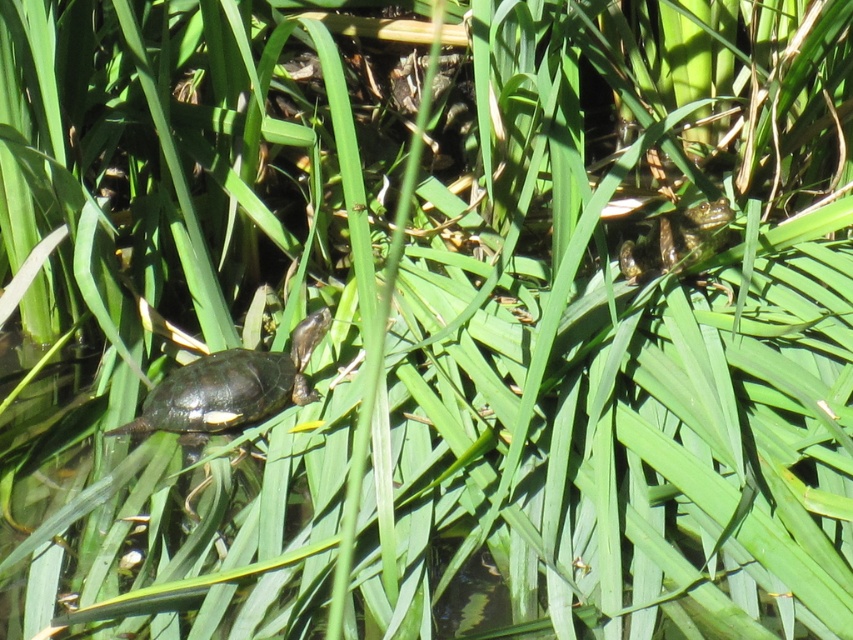
Question: Is shiny black tortoise at left wider than green scaly tortoise at upper right?

Choices:
 (A) yes
 (B) no

Answer: (A)

Question: From the image, what is the correct spatial relationship of shiny black tortoise at left in relation to green scaly tortoise at upper right?

Choices:
 (A) left
 (B) right

Answer: (A)

Question: Which point is farther to the camera?

Choices:
 (A) (688, 216)
 (B) (207, 362)

Answer: (A)

Question: Is shiny black tortoise at left positioned before green scaly tortoise at upper right?

Choices:
 (A) no
 (B) yes

Answer: (B)